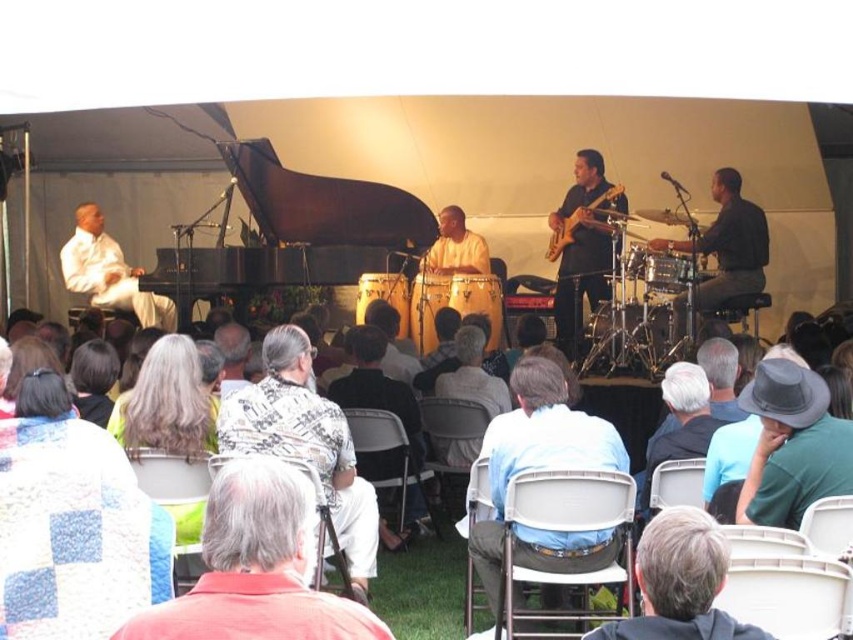
You are a photographer at the live music event and need to capture a photo of both the flannel shirt at center and the gray fabric hat at upper center. Which object should you adjust your camera focus on first if you want to ensure both are in frame without moving the camera?

The flannel shirt at center is wider than the gray fabric hat at upper center, so you should focus on the flannel shirt at center first to ensure it fits within the frame before adjusting for the smaller gray fabric hat at upper center.

You are a photographer at the live music performance. You want to capture a photo of the gray fabric hat at upper center located at point (x=679, y=582). What is the exact coordinate of the gray fabric hat at upper center?

The gray fabric hat at upper center is located at point (x=679, y=582).

You are standing at the point marked as point (679, 561) in the image. The stage is 6 meters away from you. Can you reach the stage without moving past the point?

The distance of point (679, 561) from camera is 6.72 meters. Since the stage is 6 meters away, you can reach the stage without moving past the point because the point is closer to the camera than the stage.